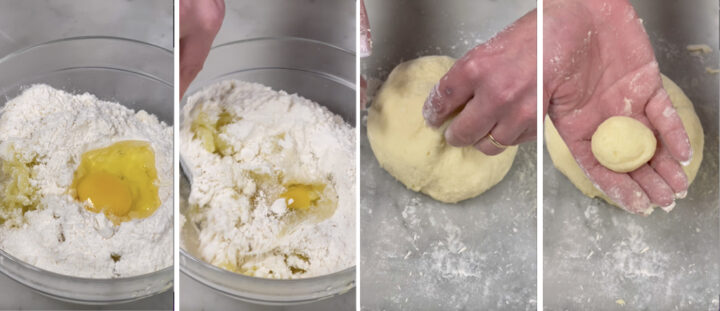
The height and width of the screenshot is (311, 720). In order to click on kitchen counterspace in this screenshot , I will do `click(99, 22)`, `click(302, 24)`, `click(433, 24)`, `click(680, 29)`.